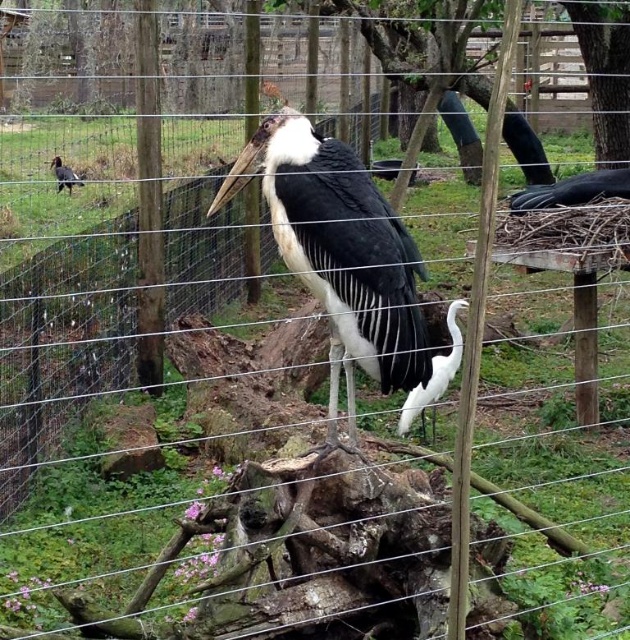
Question: Is the position of white glossy egret at center more distant than that of shiny black bird at left?

Choices:
 (A) no
 (B) yes

Answer: (A)

Question: Which object is the closest to the white feathered bird at center?

Choices:
 (A) white glossy egret at center
 (B) shiny black bird at left

Answer: (A)

Question: Which point is closer to the camera taking this photo?

Choices:
 (A) (418, 396)
 (B) (329, 195)

Answer: (B)

Question: Does white feathered bird at center appear on the right side of white glossy egret at center?

Choices:
 (A) yes
 (B) no

Answer: (B)

Question: Which object is positioned farthest from the shiny black bird at left?

Choices:
 (A) white glossy egret at center
 (B) white feathered bird at center

Answer: (B)

Question: Can you confirm if white feathered bird at center is positioned above white glossy egret at center?

Choices:
 (A) yes
 (B) no

Answer: (A)